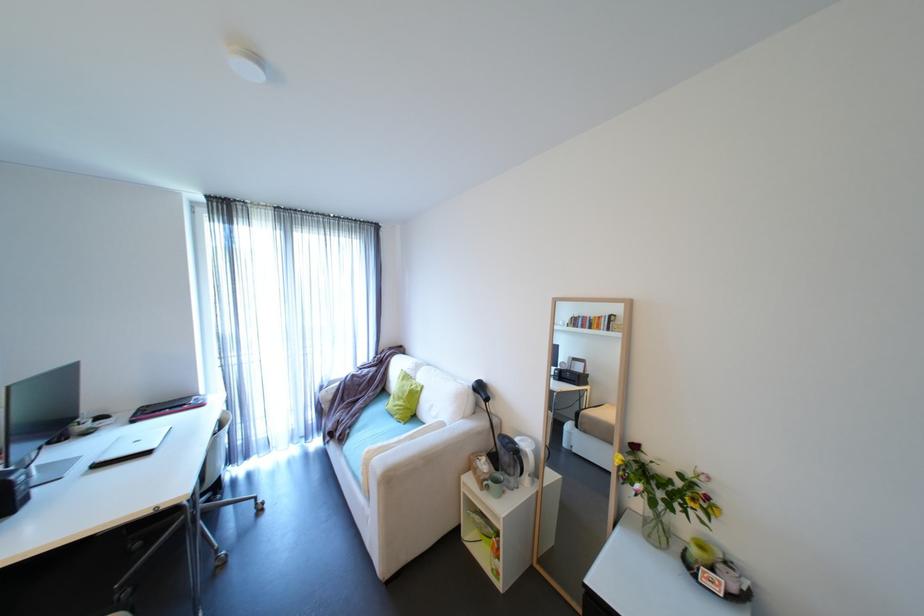
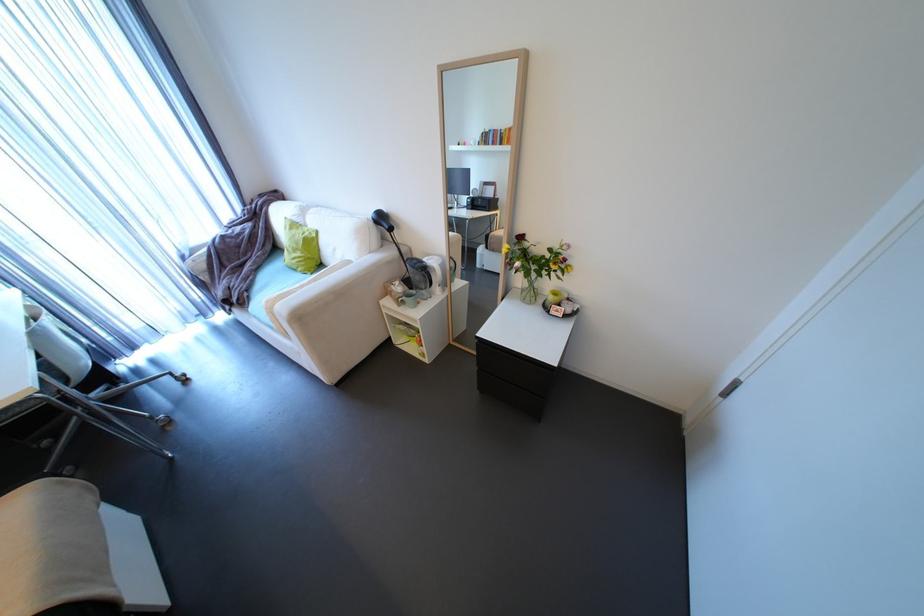
In the second image, find the point that corresponds to pixel 347 438 in the first image.

(248, 302)